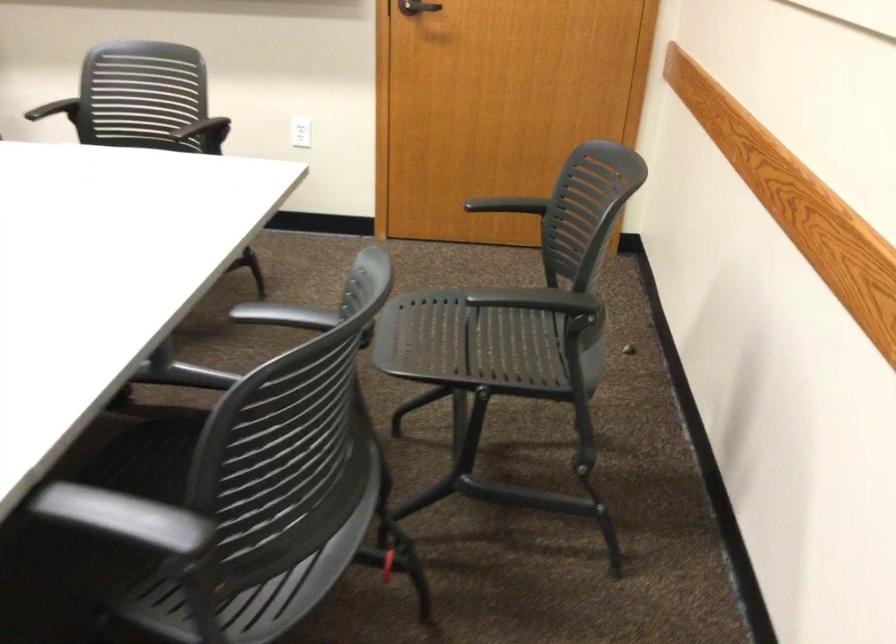
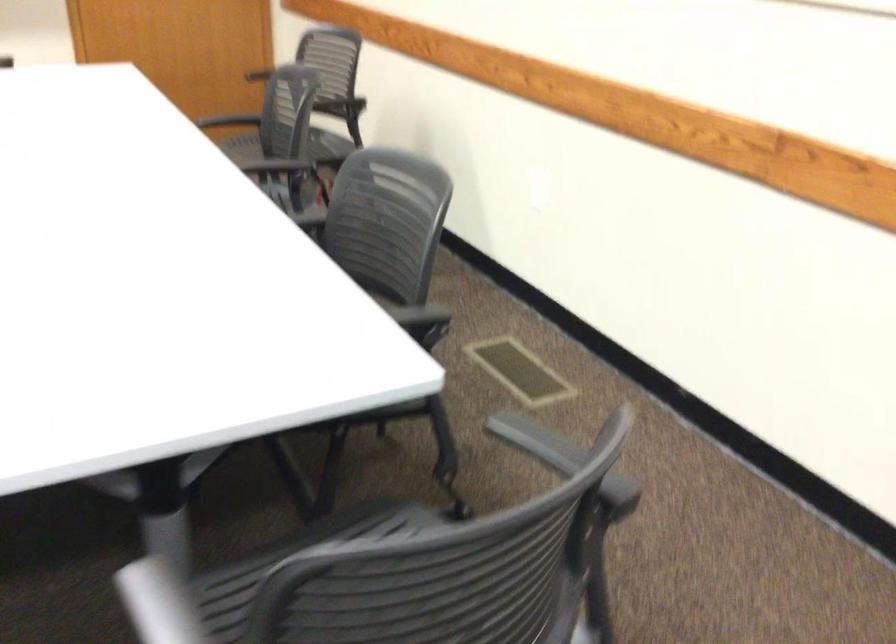
The point at [286,312] is marked in the first image. Where is the corresponding point in the second image?

(228, 120)